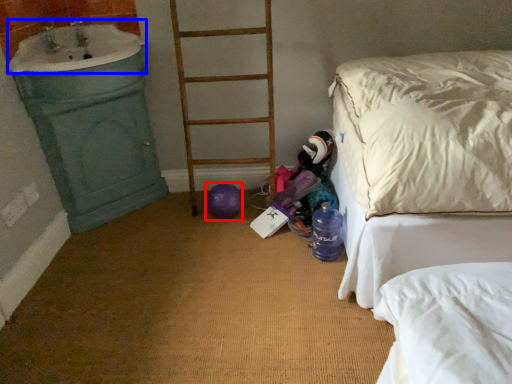
Question: Which point is further to the camera, balloon (highlighted by a red box) or sink (highlighted by a blue box)?

Choices:
 (A) balloon
 (B) sink

Answer: (A)